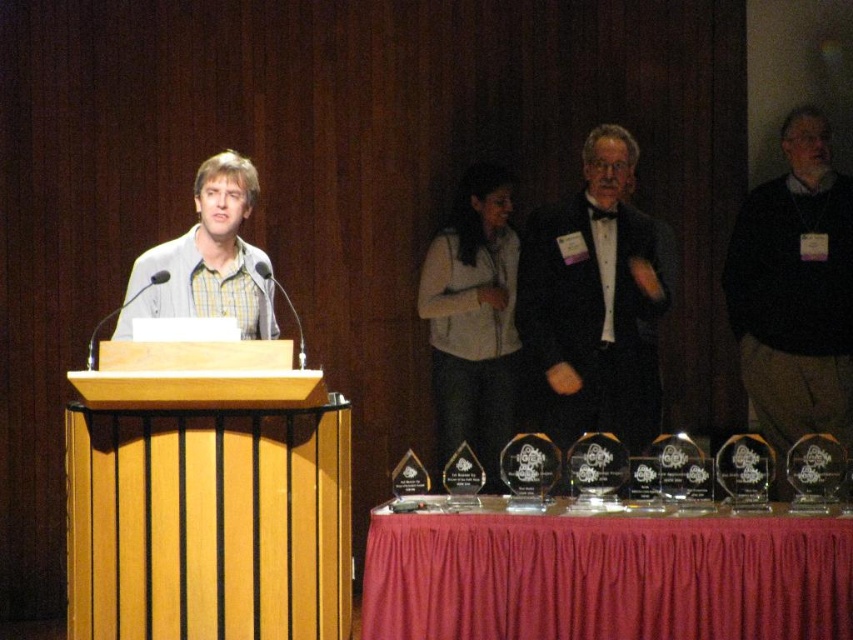
Measure the distance from black satin tuxedo at center to black sweater at right.

black satin tuxedo at center is 28.99 inches from black sweater at right.

Can you confirm if black satin tuxedo at center is positioned to the left of black sweater at right?

Yes, black satin tuxedo at center is to the left of black sweater at right.

Does point (550, 356) come farther from viewer compared to point (782, 253)?

No.

This screenshot has width=853, height=640. What are the coordinates of `black satin tuxedo at center` in the screenshot? It's located at (595, 301).

Is black satin tuxedo at center to the right of yellow-green plaid shirt at center from the viewer's perspective?

Yes, black satin tuxedo at center is to the right of yellow-green plaid shirt at center.

Which is more to the right, black satin tuxedo at center or yellow-green plaid shirt at center?

black satin tuxedo at center is more to the right.

Who is more forward, (595, 406) or (231, 300)?

Point (231, 300)

Identify the location of black satin tuxedo at center. The width and height of the screenshot is (853, 640). (595, 301).

Is black sweater at right closer to the viewer compared to yellow-green plaid shirt at center?

No, it is behind yellow-green plaid shirt at center.

Between black sweater at right and yellow-green plaid shirt at center, which one is positioned lower?

black sweater at right is lower down.

Is point (755, 236) closer to viewer compared to point (235, 310)?

No, (755, 236) is behind (235, 310).

The image size is (853, 640). What are the coordinates of `black sweater at right` in the screenshot? It's located at (795, 292).